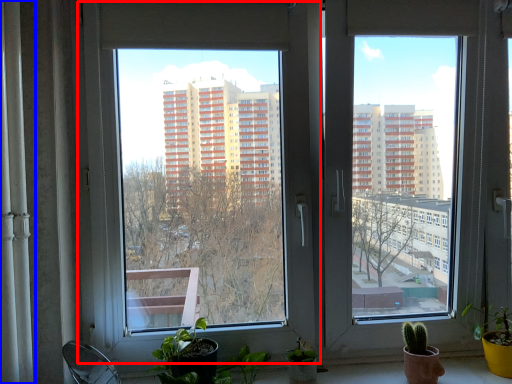
Question: Which of the following is the farthest to the observer, window (highlighted by a red box) or curtain (highlighted by a blue box)?

Choices:
 (A) window
 (B) curtain

Answer: (A)